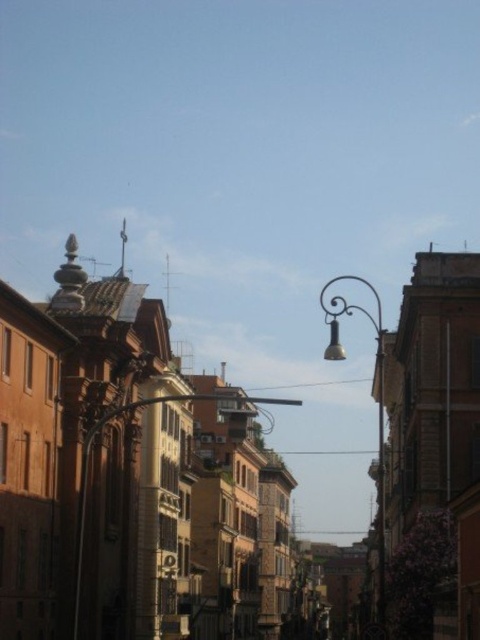
You are standing on the street looking up and see the metallic curved street light at upper center. If you were to draw a straight line from your eye level to the base of the street light, would it intersect the light pole before reaching the ground?

The metallic curved street light at upper center is positioned at coordinates point [376,401]. Since the light is at upper center, its base would be directly below it. Drawing a straight line from your eye level to the base would intersect the pole only if the pole is between you and the base. However, since the light is in front of you on the street, the line would reach the base without intersecting the pole first.

You are standing on the street and looking up at the buildings. Which metallic street light is closer to you, the metallic curved street light at upper center or the metallic streetlight at center?

The metallic curved street light at upper center is closer to you because it is in front of the metallic streetlight at center.